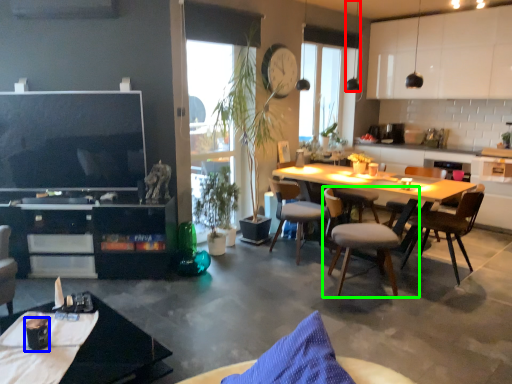
Question: Estimate the real-world distances between objects in this image. Which object is farther from lamp (highlighted by a red box), coffee cup (highlighted by a blue box) or chair (highlighted by a green box)?

Choices:
 (A) coffee cup
 (B) chair

Answer: (A)